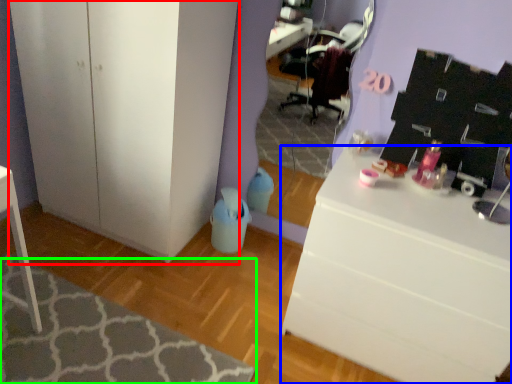
Question: Based on their relative distances, which object is farther from cabinetry (highlighted by a red box)? Choose from desk (highlighted by a blue box) and mat (highlighted by a green box).

Choices:
 (A) desk
 (B) mat

Answer: (A)